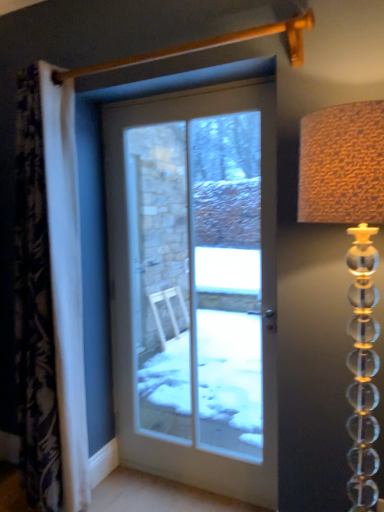
What do you see at coordinates (195, 286) in the screenshot? The height and width of the screenshot is (512, 384). I see `white glass door at center` at bounding box center [195, 286].

Locate an element on the screen. This screenshot has height=512, width=384. white fabric curtain at left is located at coordinates (34, 309).

This screenshot has height=512, width=384. I want to click on translucent glass lampshade at right, so click(x=351, y=255).

Is translucent glass lampshade at right smaller than white glass door at center?

Indeed, translucent glass lampshade at right has a smaller size compared to white glass door at center.

Is translucent glass lampshade at right aimed at white glass door at center?

No, translucent glass lampshade at right is not oriented towards white glass door at center.

Is translucent glass lampshade at right outside of white glass door at center?

Absolutely, translucent glass lampshade at right is external to white glass door at center.

Which object is further away from the camera, white glass door at center or white fabric curtain at left?

Positioned behind is white glass door at center.

Considering the sizes of objects white glass door at center and white fabric curtain at left in the image provided, who is thinner, white glass door at center or white fabric curtain at left?

With smaller width is white glass door at center.

Where is `curtain on the left of white glass door at center`? The height and width of the screenshot is (512, 384). curtain on the left of white glass door at center is located at coordinates (34, 309).

Considering the relative sizes of white glass door at center and white fabric curtain at left in the image provided, is white glass door at center smaller than white fabric curtain at left?

Yes, white glass door at center is smaller than white fabric curtain at left.

Is white fabric curtain at left not close to translucent glass lampshade at right?

That's right, there is a large distance between white fabric curtain at left and translucent glass lampshade at right.

From a real-world perspective, is white fabric curtain at left positioned above or below translucent glass lampshade at right?

In terms of real-world spatial position, white fabric curtain at left is above translucent glass lampshade at right.

In the scene shown: Which of these two, white fabric curtain at left or translucent glass lampshade at right, is bigger?

With larger size is white fabric curtain at left.

Does white fabric curtain at left have a greater width compared to translucent glass lampshade at right?

No.

The image size is (384, 512). Find the location of `curtain above the translucent glass lampshade at right (from a real-world perspective)`. curtain above the translucent glass lampshade at right (from a real-world perspective) is located at coordinates (34, 309).

Is translucent glass lampshade at right turned away from white fabric curtain at left?

No, translucent glass lampshade at right is not facing the opposite direction of white fabric curtain at left.

Can you confirm if translucent glass lampshade at right is smaller than white fabric curtain at left?

Indeed, translucent glass lampshade at right has a smaller size compared to white fabric curtain at left.

Can you confirm if translucent glass lampshade at right is taller than white fabric curtain at left?

No.

Is white fabric curtain at left facing away from white glass door at center?

No, white fabric curtain at left is not facing away from white glass door at center.

From a real-world perspective, is white fabric curtain at left beneath white glass door at center?

No, from a real-world perspective, white fabric curtain at left is not under white glass door at center.

Identify the location of door located below the white fabric curtain at left (from the image's perspective). Image resolution: width=384 pixels, height=512 pixels. (195, 286).

Is white fabric curtain at left placed right next to white glass door at center?

No, white fabric curtain at left is not with white glass door at center.

Could you tell me if white glass door at center is turned towards translucent glass lampshade at right?

No, white glass door at center does not turn towards translucent glass lampshade at right.

Considering the positions of objects white glass door at center and translucent glass lampshade at right in the image provided, who is in front, white glass door at center or translucent glass lampshade at right?

translucent glass lampshade at right is more forward.

In order to click on table lamp that appears below the white glass door at center (from the image's perspective) in this screenshot , I will do `click(351, 255)`.

From the image's perspective, would you say white glass door at center is shown under translucent glass lampshade at right?

Actually, white glass door at center appears above translucent glass lampshade at right in the image.

Find the location of a particular element. table lamp that is in front of the white glass door at center is located at coordinates (351, 255).

The height and width of the screenshot is (512, 384). I want to click on curtain above the white glass door at center (from the image's perspective), so click(34, 309).

Looking at the image, which one is located closer to white fabric curtain at left, translucent glass lampshade at right or white glass door at center?

The object closer to white fabric curtain at left is translucent glass lampshade at right.

Considering their positions, is white fabric curtain at left positioned further to translucent glass lampshade at right than white glass door at center?

white glass door at center lies further to translucent glass lampshade at right than the other object.

Which object lies further to the anchor point white fabric curtain at left, white glass door at center or translucent glass lampshade at right?

Based on the image, white glass door at center appears to be further to white fabric curtain at left.

Considering their positions, is white glass door at center positioned further to translucent glass lampshade at right than white fabric curtain at left?

white glass door at center.

When comparing their distances from white glass door at center, does white fabric curtain at left or translucent glass lampshade at right seem closer?

white fabric curtain at left.

When comparing their distances from white glass door at center, does translucent glass lampshade at right or white fabric curtain at left seem further?

Among the two, translucent glass lampshade at right is located further to white glass door at center.

At what (x,y) coordinates should I click in order to perform the action: click on door located between white fabric curtain at left and translucent glass lampshade at right in the left-right direction. Please return your answer as a coordinate pair (x, y). The height and width of the screenshot is (512, 384). Looking at the image, I should click on (195, 286).